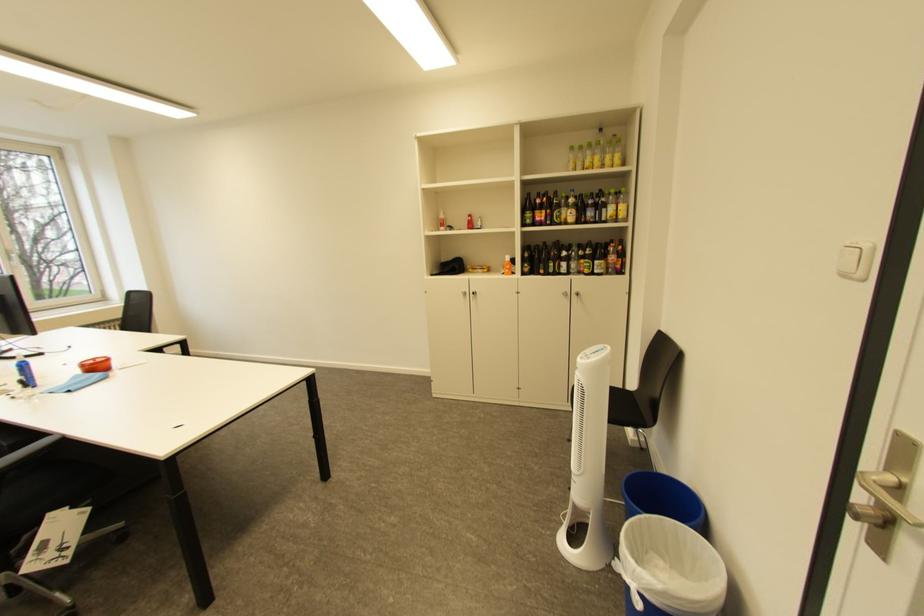
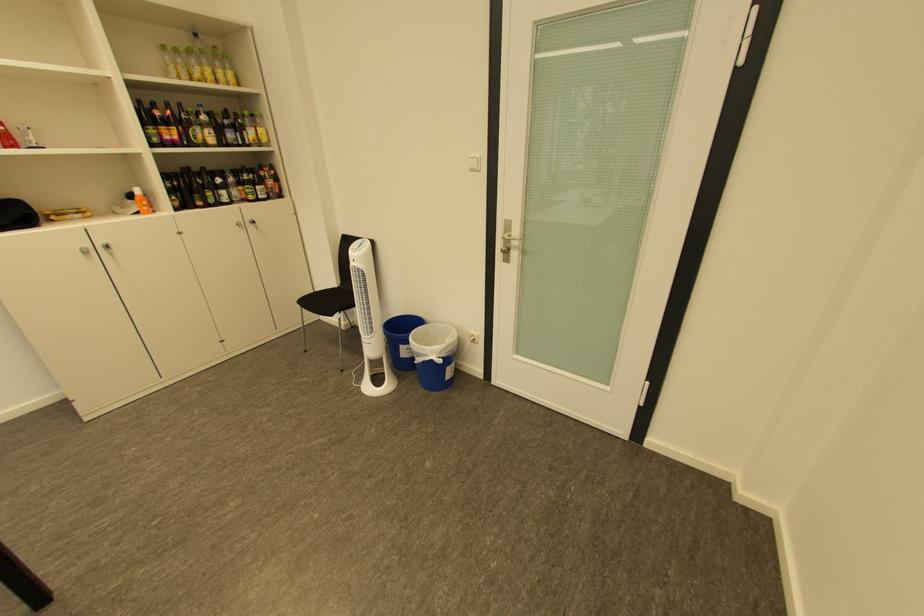
In the second image, find the point that corresponds to point 581,201 in the first image.

(213, 119)